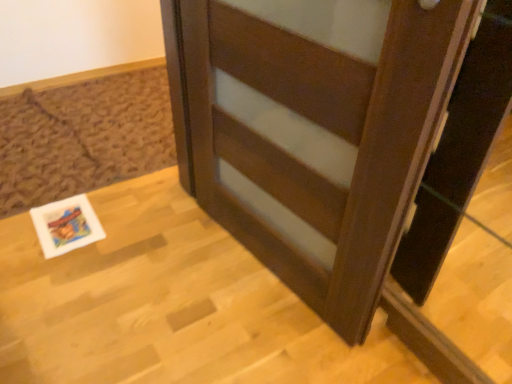
Question: Considering the relative sizes of wooden table at center and white glossy postcard at lower left in the image provided, is wooden table at center wider than white glossy postcard at lower left?

Choices:
 (A) yes
 (B) no

Answer: (A)

Question: From the image's perspective, does wooden table at center appear lower than white glossy postcard at lower left?

Choices:
 (A) no
 (B) yes

Answer: (B)

Question: Is wooden table at center far away from white glossy postcard at lower left?

Choices:
 (A) no
 (B) yes

Answer: (A)

Question: Does wooden table at center appear on the left side of white glossy postcard at lower left?

Choices:
 (A) yes
 (B) no

Answer: (B)

Question: Is wooden table at center positioned behind white glossy postcard at lower left?

Choices:
 (A) no
 (B) yes

Answer: (A)

Question: Considering the positions of brown wood door at center and white glossy postcard at lower left in the image, is brown wood door at center wider or thinner than white glossy postcard at lower left?

Choices:
 (A) wide
 (B) thin

Answer: (A)

Question: Considering the positions of brown wood door at center and white glossy postcard at lower left in the image, is brown wood door at center bigger or smaller than white glossy postcard at lower left?

Choices:
 (A) big
 (B) small

Answer: (A)

Question: From a real-world perspective, is brown wood door at center positioned above or below white glossy postcard at lower left?

Choices:
 (A) below
 (B) above

Answer: (B)

Question: Would you say brown wood door at center is to the left or to the right of white glossy postcard at lower left in the picture?

Choices:
 (A) left
 (B) right

Answer: (B)

Question: In the image, is wooden table at center on the left side or the right side of white glossy postcard at lower left?

Choices:
 (A) right
 (B) left

Answer: (A)

Question: Is wooden table at center spatially inside white glossy postcard at lower left, or outside of it?

Choices:
 (A) outside
 (B) inside

Answer: (A)

Question: Considering the positions of wooden table at center and white glossy postcard at lower left in the image, is wooden table at center taller or shorter than white glossy postcard at lower left?

Choices:
 (A) short
 (B) tall

Answer: (B)

Question: Looking at their shapes, would you say wooden table at center is wider or thinner than white glossy postcard at lower left?

Choices:
 (A) wide
 (B) thin

Answer: (A)

Question: From the image's perspective, is white glossy postcard at lower left above or below wooden table at center?

Choices:
 (A) above
 (B) below

Answer: (A)

Question: From a real-world perspective, is white glossy postcard at lower left physically located above or below wooden table at center?

Choices:
 (A) above
 (B) below

Answer: (A)